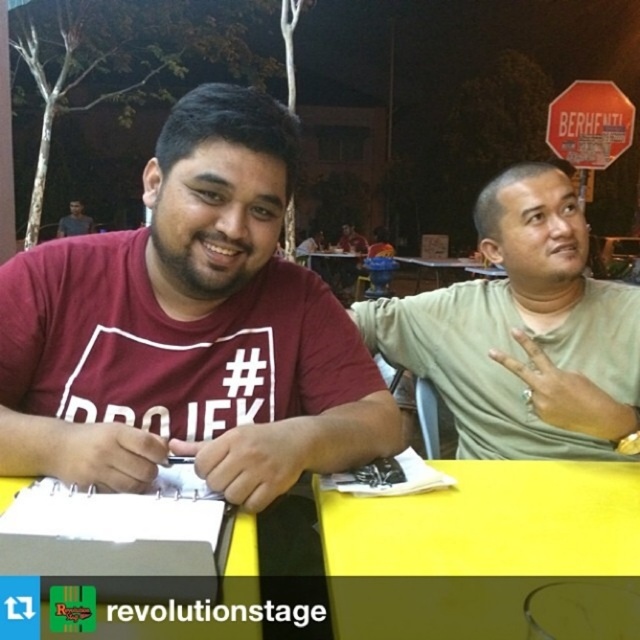
Please look at the image and locate the point at coordinates (189, 328). What object in the scene is located at that point?

The maroon t shirt at center is located at point (189, 328).